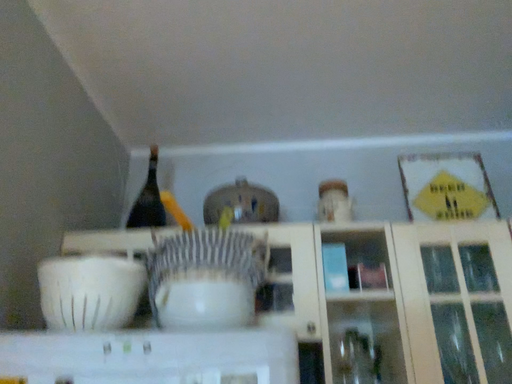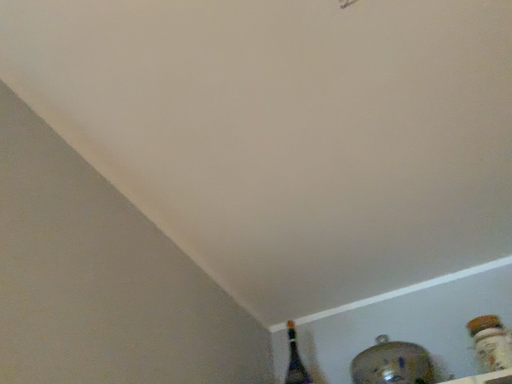
Question: Which way did the camera rotate in the video?

Choices:
 (A) rotated right
 (B) rotated left

Answer: (B)